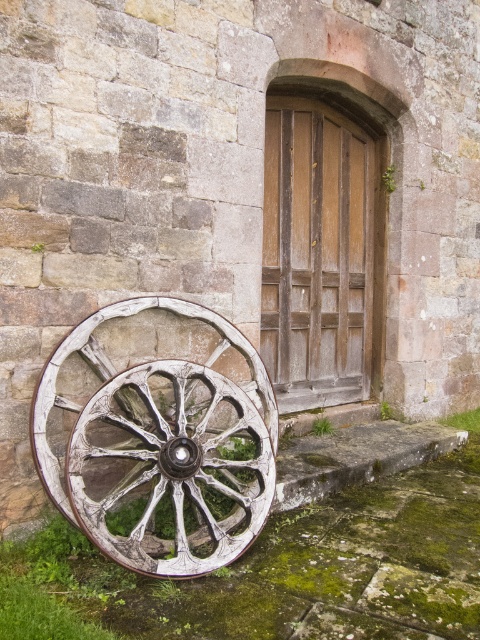
Question: Which of the following is the farthest from the observer?

Choices:
 (A) wooden door at center
 (B) white wooden wagon wheel at lower left

Answer: (A)

Question: Does white wooden wagon wheel at lower left have a larger size compared to wooden door at center?

Choices:
 (A) yes
 (B) no

Answer: (B)

Question: Which object is closer to the camera taking this photo?

Choices:
 (A) wooden door at center
 (B) white wooden wagon wheel at lower left

Answer: (B)

Question: Is white wooden wagon wheel at lower left further to the viewer compared to wooden door at center?

Choices:
 (A) yes
 (B) no

Answer: (B)

Question: Is white wooden wagon wheel at lower left further to the viewer compared to wooden door at center?

Choices:
 (A) yes
 (B) no

Answer: (B)